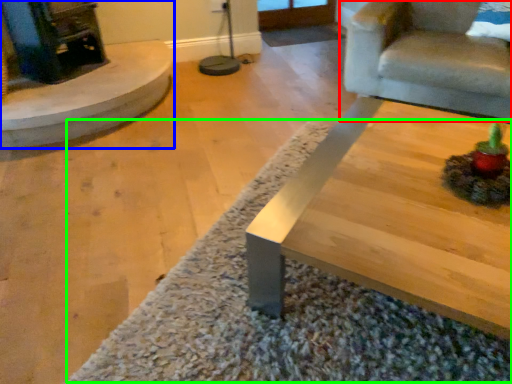
Question: Based on their relative distances, which object is farther from chair (highlighted by a red box)? Choose from fireplace (highlighted by a blue box) and mat (highlighted by a green box).

Choices:
 (A) fireplace
 (B) mat

Answer: (A)